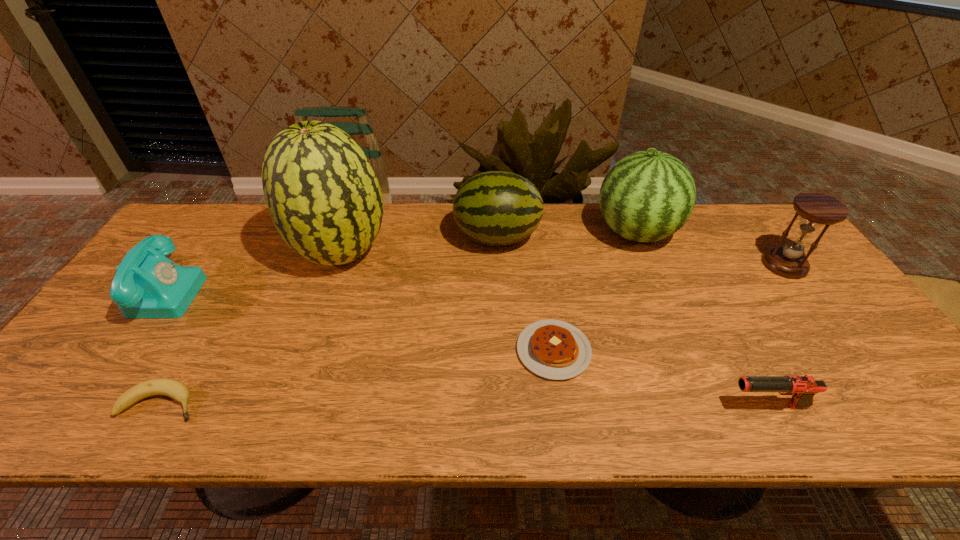
What are the coordinates of `free region located on the left of the pancake` in the screenshot? It's located at (429, 350).

You are a GUI agent. You are given a task and a screenshot of the screen. Output one action in this format:
    pyautogui.click(x=<x>, y=<y>)
    Task: Click on the vacant space located 0.360m at the stem of the banana
    
    Given the screenshot: What is the action you would take?
    pyautogui.click(x=365, y=403)

This screenshot has height=540, width=960. Find the location of `gun at the near edge`. gun at the near edge is located at coordinates (802, 388).

What are the coordinates of `banana present at the near edge` in the screenshot? It's located at (176, 390).

At what (x,y) coordinates should I click in order to perform the action: click on object that is at the left edge. Please return your answer as a coordinate pair (x, y). This screenshot has height=540, width=960. Looking at the image, I should click on (x=147, y=284).

Where is `object that is at the right edge`? Image resolution: width=960 pixels, height=540 pixels. object that is at the right edge is located at coordinates (816, 209).

Where is `blank space at the far edge of the desktop`? This screenshot has width=960, height=540. blank space at the far edge of the desktop is located at coordinates (457, 227).

Locate an element on the screen. vacant area at the near edge of the desktop is located at coordinates (305, 429).

Locate an element on the screen. free space at the left edge of the desktop is located at coordinates (47, 390).

This screenshot has width=960, height=540. Identify the location of vacant region at the right edge of the desktop. (852, 348).